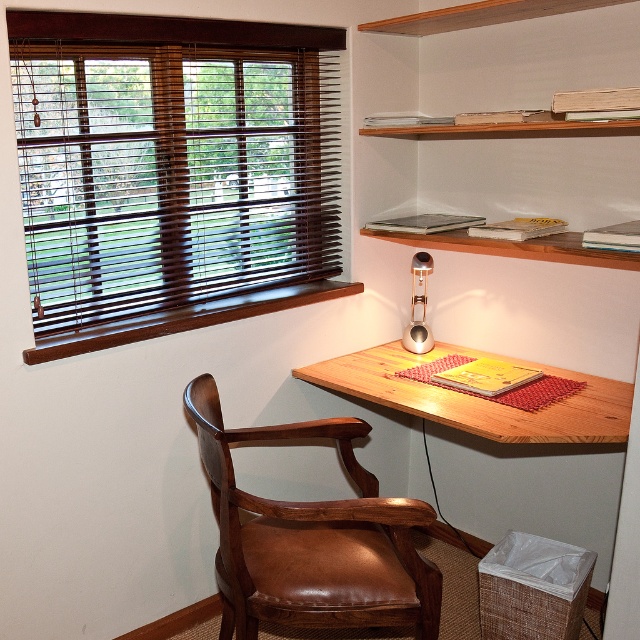
Is brown leather swivel chair at lower left further to camera compared to wooden desk at center?

That is False.

Identify the location of brown leather swivel chair at lower left. Image resolution: width=640 pixels, height=640 pixels. (310, 538).

Find the location of a particular element. The image size is (640, 640). brown leather swivel chair at lower left is located at coordinates (310, 538).

Measure the distance between point (33, 362) and camera.

Point (33, 362) and camera are 6.15 feet apart.

Is brown wood blinds at upper left bigger than brown leather swivel chair at lower left?

Yes.

Is point (93, 152) positioned in front of point (323, 532)?

No, it is behind (323, 532).

What are the coordinates of `brown wood blinds at upper left` in the screenshot? It's located at (173, 172).

Is point (67, 294) behind point (422, 333)?

No, it is not.

This screenshot has height=640, width=640. What are the coordinates of `brown wood blinds at upper left` in the screenshot? It's located at (173, 172).